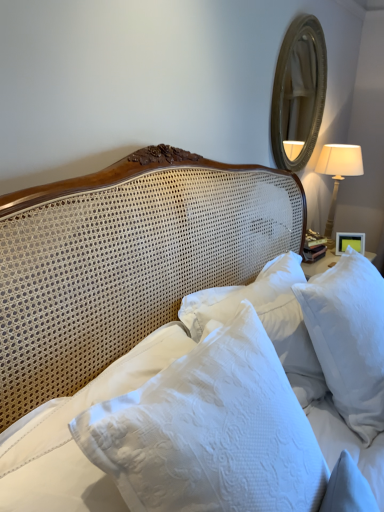
Question: Is gold-toned wooden mirror at upper right aimed at white textured pillows at center?

Choices:
 (A) yes
 (B) no

Answer: (B)

Question: Is there a large distance between gold-toned wooden mirror at upper right and white textured pillows at center?

Choices:
 (A) yes
 (B) no

Answer: (A)

Question: Considering the relative sizes of gold-toned wooden mirror at upper right and white textured pillows at center in the image provided, is gold-toned wooden mirror at upper right smaller than white textured pillows at center?

Choices:
 (A) yes
 (B) no

Answer: (A)

Question: Is gold-toned wooden mirror at upper right directly adjacent to white textured pillows at center?

Choices:
 (A) no
 (B) yes

Answer: (A)

Question: From a real-world perspective, does gold-toned wooden mirror at upper right sit lower than white textured pillows at center?

Choices:
 (A) yes
 (B) no

Answer: (B)

Question: Considering the positions of point (74, 479) and point (301, 32), is point (74, 479) closer or farther from the camera than point (301, 32)?

Choices:
 (A) closer
 (B) farther

Answer: (A)

Question: Considering the positions of white textured pillows at center and gold-toned wooden mirror at upper right in the image, is white textured pillows at center bigger or smaller than gold-toned wooden mirror at upper right?

Choices:
 (A) big
 (B) small

Answer: (A)

Question: From their relative heights in the image, would you say white textured pillows at center is taller or shorter than gold-toned wooden mirror at upper right?

Choices:
 (A) tall
 (B) short

Answer: (B)

Question: Is white textured pillows at center to the left or to the right of gold-toned wooden mirror at upper right in the image?

Choices:
 (A) right
 (B) left

Answer: (B)

Question: From the image's perspective, is white glossy picture frame at upper right positioned above or below white fabric lampshade at right?

Choices:
 (A) above
 (B) below

Answer: (B)

Question: From a real-world perspective, relative to white fabric lampshade at right, is white glossy picture frame at upper right vertically above or below?

Choices:
 (A) above
 (B) below

Answer: (B)

Question: In terms of height, does white glossy picture frame at upper right look taller or shorter compared to white fabric lampshade at right?

Choices:
 (A) tall
 (B) short

Answer: (B)

Question: Based on their positions, is white glossy picture frame at upper right located to the left or right of white fabric lampshade at right?

Choices:
 (A) right
 (B) left

Answer: (A)

Question: In the image, is white glossy picture frame at upper right positioned in front of or behind white textured pillows at center?

Choices:
 (A) front
 (B) behind

Answer: (B)

Question: Considering the positions of white glossy picture frame at upper right and white textured pillows at center in the image, is white glossy picture frame at upper right bigger or smaller than white textured pillows at center?

Choices:
 (A) big
 (B) small

Answer: (B)